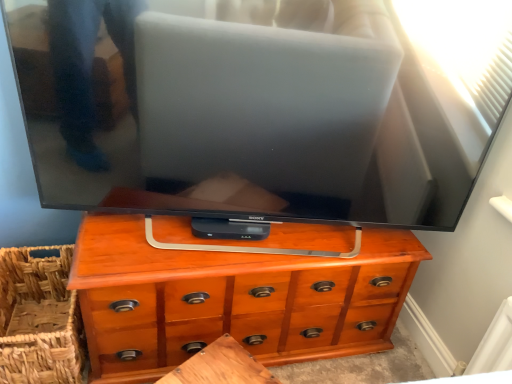
At what (x,y) coordinates should I click in order to perform the action: click on vacant point above wooden chest of drawers at center (from a real-world perspective). Please return your answer as a coordinate pair (x, y). The width and height of the screenshot is (512, 384). Looking at the image, I should click on pyautogui.click(x=239, y=232).